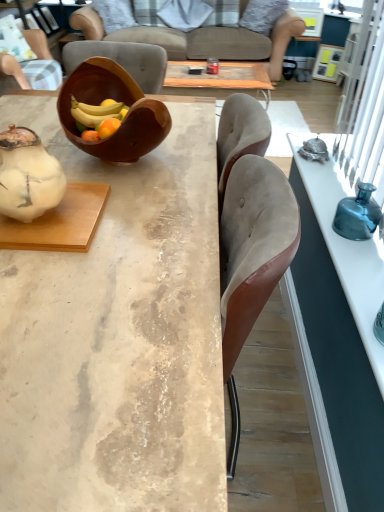
Question: Can you confirm if brown wooden bowl at center is positioned to the left of fluffy gray pillow at upper center, which is the 2th pillow in left-to-right order?

Choices:
 (A) no
 (B) yes

Answer: (B)

Question: Is brown wooden bowl at center turned away from fluffy gray pillow at upper center, which is the 2th pillow in left-to-right order?

Choices:
 (A) no
 (B) yes

Answer: (A)

Question: From the image's perspective, is brown wooden bowl at center beneath fluffy gray pillow at upper center, which is the 2th pillow in left-to-right order?

Choices:
 (A) yes
 (B) no

Answer: (A)

Question: Is the position of brown wooden bowl at center less distant than that of fluffy gray pillow at upper center, which is the 2th pillow in left-to-right order?

Choices:
 (A) no
 (B) yes

Answer: (B)

Question: Is brown wooden bowl at center taller than fluffy gray pillow at upper center, which is the 2th pillow in left-to-right order?

Choices:
 (A) no
 (B) yes

Answer: (A)

Question: From a real-world perspective, relative to white matte teapot at left, is marble table at center, the second desk from the right, vertically above or below?

Choices:
 (A) above
 (B) below

Answer: (B)

Question: Based on their positions, is marble table at center, the second desk from the right, located to the left or right of white matte teapot at left?

Choices:
 (A) left
 (B) right

Answer: (B)

Question: From the image's perspective, is marble table at center, which ranks as the first desk in left-to-right order, located above or below white matte teapot at left?

Choices:
 (A) below
 (B) above

Answer: (A)

Question: Considering their positions, is marble table at center, the second desk from the right, located in front of or behind white matte teapot at left?

Choices:
 (A) behind
 (B) front

Answer: (B)

Question: Does point (362, 283) appear closer or farther from the camera than point (13, 73)?

Choices:
 (A) farther
 (B) closer

Answer: (B)

Question: Considering the positions of teal glass vase at right, the 2th desk from the left, and suede chair at upper left in the image, is teal glass vase at right, the 2th desk from the left, taller or shorter than suede chair at upper left?

Choices:
 (A) short
 (B) tall

Answer: (A)

Question: From a real-world perspective, is teal glass vase at right, the 2th desk from the left, positioned above or below suede chair at upper left?

Choices:
 (A) below
 (B) above

Answer: (A)

Question: In the image, is teal glass vase at right, the 2th desk from the left, positioned in front of or behind suede chair at upper left?

Choices:
 (A) front
 (B) behind

Answer: (A)

Question: Considering the positions of brown wooden bowl at center and suede chair at upper left in the image, is brown wooden bowl at center wider or thinner than suede chair at upper left?

Choices:
 (A) thin
 (B) wide

Answer: (A)

Question: Is brown wooden bowl at center situated inside suede chair at upper left or outside?

Choices:
 (A) inside
 (B) outside

Answer: (B)